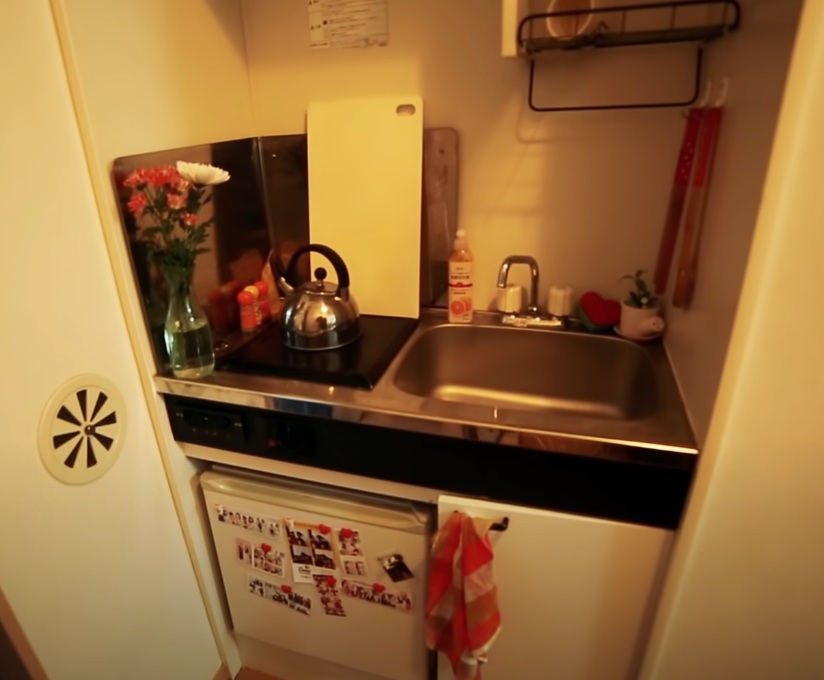
Where is `glass vase`? The height and width of the screenshot is (680, 824). glass vase is located at coordinates (186, 330).